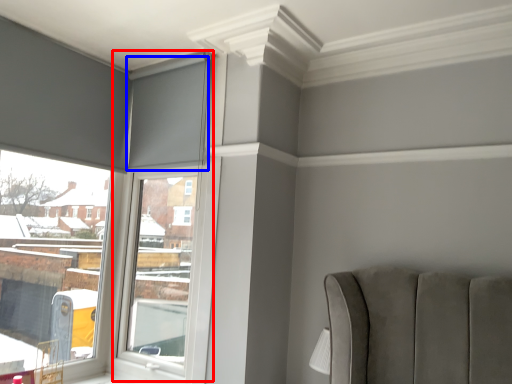
Question: Which of the following is the farthest to the observer, window frame (highlighted by a red box) or curtain (highlighted by a blue box)?

Choices:
 (A) window frame
 (B) curtain

Answer: (B)